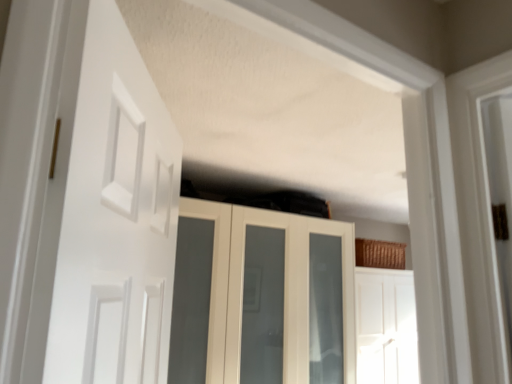
Question: Does white matte door at left, which is counted as the second door, starting from the right, come in front of white glossy door at center, which ranks as the 1th door in bottom-to-top order?

Choices:
 (A) yes
 (B) no

Answer: (A)

Question: Considering the relative sizes of white matte door at left, the 2th door in the back-to-front sequence, and white glossy door at center, placed as the first door when sorted from back to front, in the image provided, is white matte door at left, the 2th door in the back-to-front sequence, shorter than white glossy door at center, placed as the first door when sorted from back to front,?

Choices:
 (A) yes
 (B) no

Answer: (A)

Question: From the image's perspective, does white matte door at left, the 1th door when ordered from left to right, appear lower than white glossy door at center, marked as the second door in a left-to-right arrangement?

Choices:
 (A) yes
 (B) no

Answer: (B)

Question: Is white matte door at left, which appears as the first door when viewed from the front, oriented towards white glossy door at center, which ranks as the 1th door in bottom-to-top order?

Choices:
 (A) yes
 (B) no

Answer: (B)

Question: Does white matte door at left, which is counted as the second door, starting from the bottom, have a smaller size compared to white glossy door at center, arranged as the first door when viewed from the right?

Choices:
 (A) yes
 (B) no

Answer: (A)

Question: Considering the relative sizes of white matte door at left, which appears as the 1th door when viewed from the top, and white glossy door at center, placed as the first door when sorted from back to front, in the image provided, is white matte door at left, which appears as the 1th door when viewed from the top, wider than white glossy door at center, placed as the first door when sorted from back to front,?

Choices:
 (A) yes
 (B) no

Answer: (B)

Question: From the image's perspective, does white glossy cupboard at upper center appear higher than white glossy door at center, arranged as the first door when viewed from the right?

Choices:
 (A) no
 (B) yes

Answer: (B)

Question: Is white glossy cupboard at upper center far away from white glossy door at center, the second door in the top-to-bottom sequence?

Choices:
 (A) no
 (B) yes

Answer: (A)

Question: Is white glossy cupboard at upper center positioned behind white glossy door at center, which ranks as the 1th door in bottom-to-top order?

Choices:
 (A) no
 (B) yes

Answer: (A)

Question: From a real-world perspective, is white glossy cupboard at upper center on white glossy door at center, arranged as the first door when viewed from the right?

Choices:
 (A) no
 (B) yes

Answer: (B)

Question: Considering the relative sizes of white glossy cupboard at upper center and white glossy door at center, the 2th door viewed from the front, in the image provided, is white glossy cupboard at upper center wider than white glossy door at center, the 2th door viewed from the front,?

Choices:
 (A) no
 (B) yes

Answer: (B)

Question: Can you confirm if white glossy cupboard at upper center is smaller than white glossy door at center, which ranks as the 1th door in bottom-to-top order?

Choices:
 (A) yes
 (B) no

Answer: (B)

Question: Considering the relative sizes of white glossy door at center, marked as the second door in a left-to-right arrangement, and white matte door at left, the 2th door in the back-to-front sequence, in the image provided, is white glossy door at center, marked as the second door in a left-to-right arrangement, wider than white matte door at left, the 2th door in the back-to-front sequence,?

Choices:
 (A) yes
 (B) no

Answer: (A)